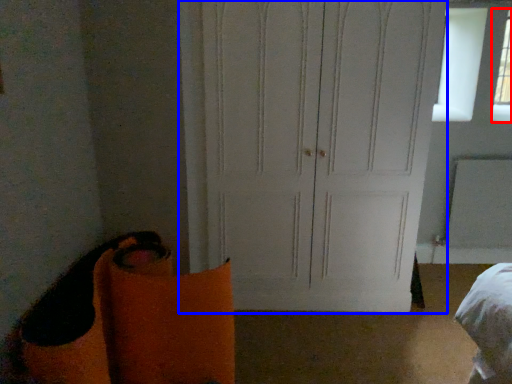
Question: Which point is closer to the camera, window (highlighted by a red box) or door (highlighted by a blue box)?

Choices:
 (A) window
 (B) door

Answer: (B)